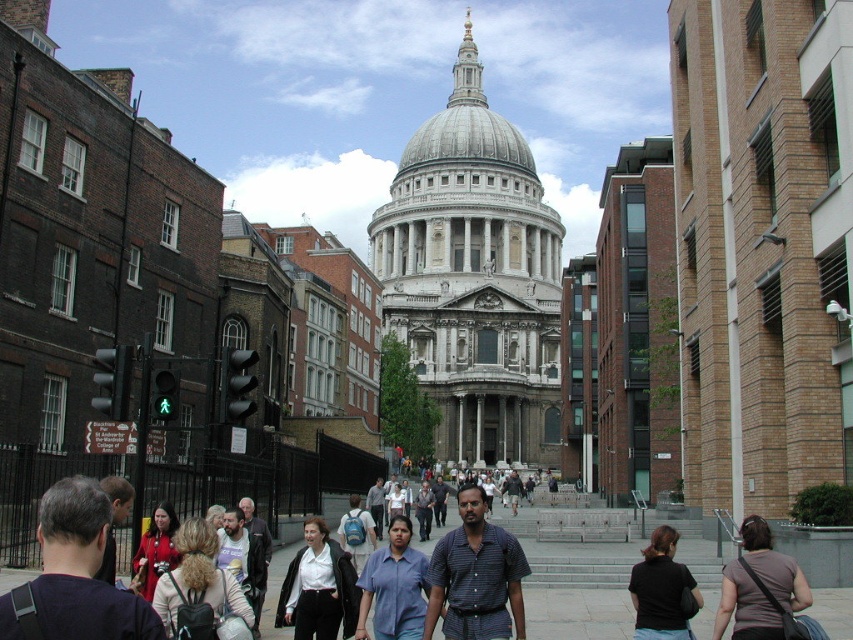
You are standing at the center of the image and want to greet the person wearing the dark gray shirt at lower right. In which direction should you move to approach them?

The dark gray shirt at lower right is located at point (759,586), which means you should move towards the lower right direction to approach them.

You are standing in front of St. Paul Cathedral and want to take a photo. You see two points marked in the scene. Which point is closer to you, point (482, 608) or point (641, 612)?

Point (482, 608) is closer to you than point (641, 612) because it is further to the camera than the other point.

You are a photographer standing on the pathway. You want to take a photo of the white marble cathedral at center without any people blocking it. Is the blue cotton shirt at center currently in front of the cathedral?

The white marble cathedral at center is positioned over the blue cotton shirt at center, meaning the cathedral is in front of the shirt. Therefore, the blue cotton shirt at center is not blocking the cathedral, so you can take the photo without any obstruction.